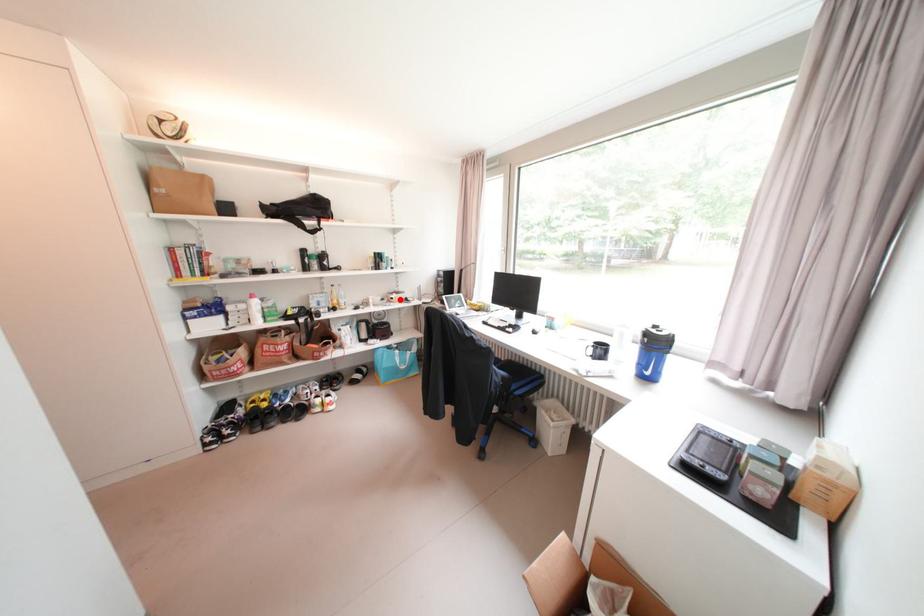
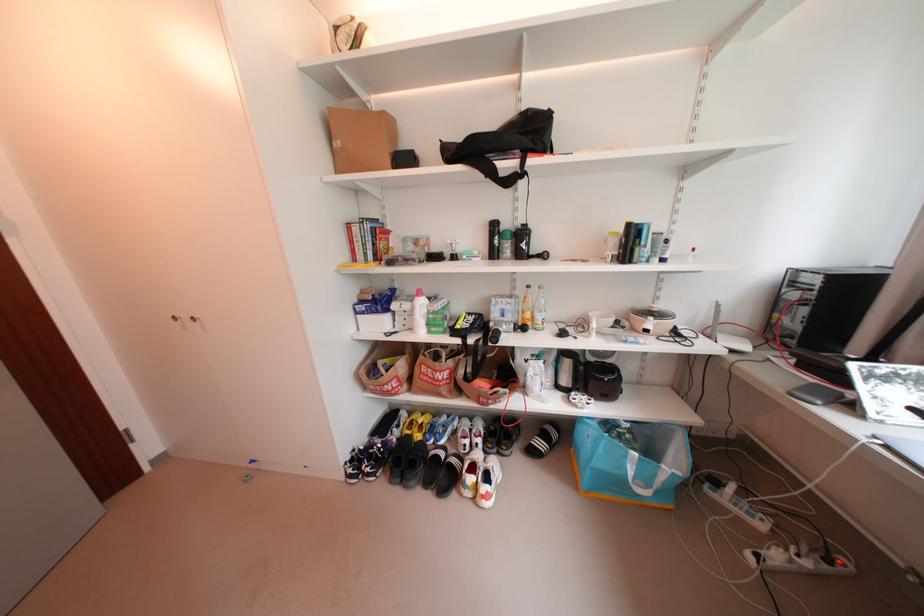
Find the pixel in the second image that matches the highlighted location in the first image.

(655, 331)